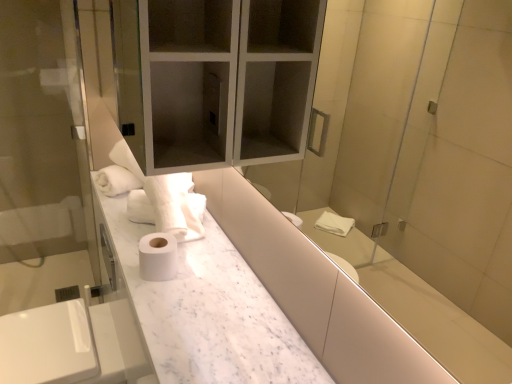
Question: Considering the relative sizes of satin nickel faucet at lower left and white marble counter at center in the image provided, is satin nickel faucet at lower left thinner than white marble counter at center?

Choices:
 (A) yes
 (B) no

Answer: (A)

Question: Is satin nickel faucet at lower left smaller than white marble counter at center?

Choices:
 (A) no
 (B) yes

Answer: (B)

Question: Is satin nickel faucet at lower left in front of white marble counter at center?

Choices:
 (A) yes
 (B) no

Answer: (B)

Question: Is satin nickel faucet at lower left far away from white marble counter at center?

Choices:
 (A) no
 (B) yes

Answer: (B)

Question: Is satin nickel faucet at lower left facing towards white marble counter at center?

Choices:
 (A) no
 (B) yes

Answer: (A)

Question: Can you confirm if satin nickel faucet at lower left is taller than white marble counter at center?

Choices:
 (A) yes
 (B) no

Answer: (A)

Question: Considering the relative positions of transparent glass screen door at left and white marble counter at center in the image provided, is transparent glass screen door at left in front of white marble counter at center?

Choices:
 (A) yes
 (B) no

Answer: (B)

Question: Can you confirm if transparent glass screen door at left is shorter than white marble counter at center?

Choices:
 (A) yes
 (B) no

Answer: (B)

Question: Does transparent glass screen door at left contain white marble counter at center?

Choices:
 (A) yes
 (B) no

Answer: (B)

Question: From the image's perspective, is transparent glass screen door at left above white marble counter at center?

Choices:
 (A) yes
 (B) no

Answer: (A)

Question: Is transparent glass screen door at left facing away from white marble counter at center?

Choices:
 (A) yes
 (B) no

Answer: (B)

Question: Is transparent glass screen door at left far from white marble counter at center?

Choices:
 (A) yes
 (B) no

Answer: (A)

Question: Would you say white marble counter at center is a long distance from transparent glass screen door at left?

Choices:
 (A) no
 (B) yes

Answer: (B)